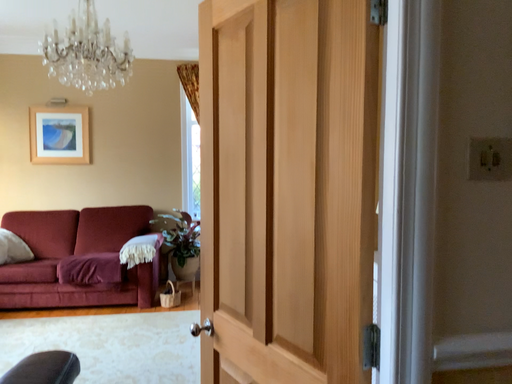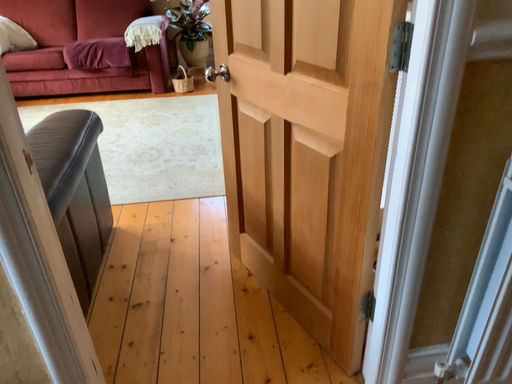
Question: How did the camera likely rotate when shooting the video?

Choices:
 (A) rotated upward
 (B) rotated downward

Answer: (B)